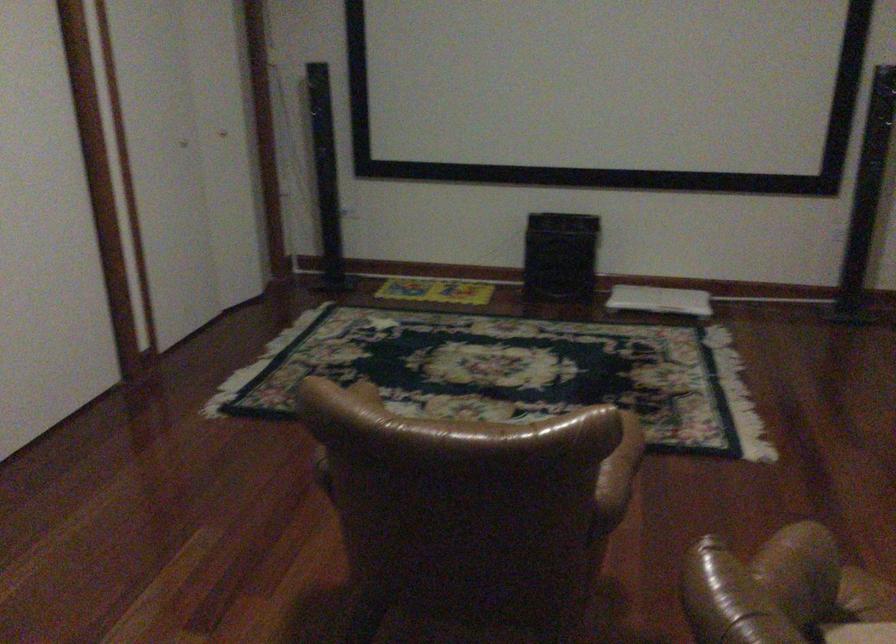
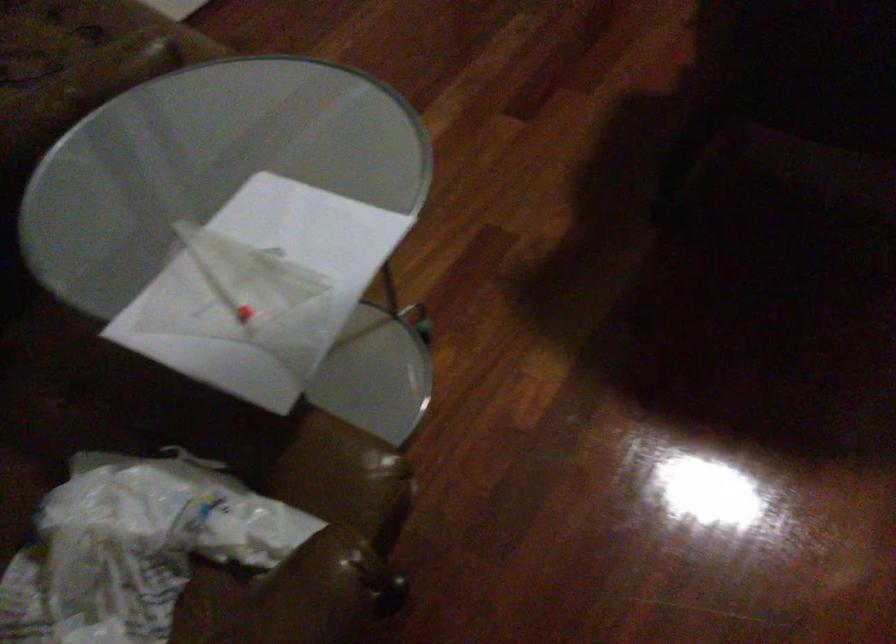
The images are taken continuously from a first-person perspective. In which direction is your viewpoint rotating?

The camera's rotation is toward left-down.